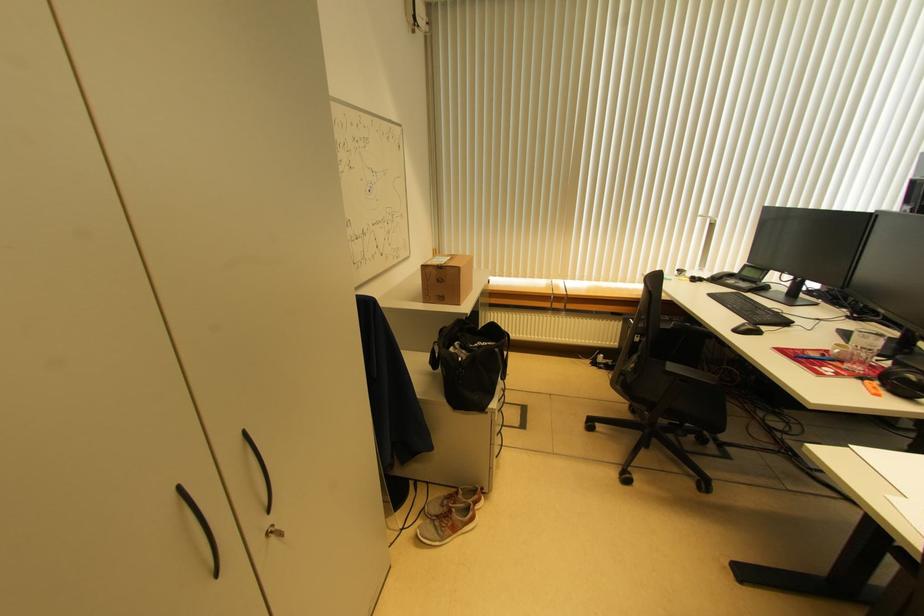
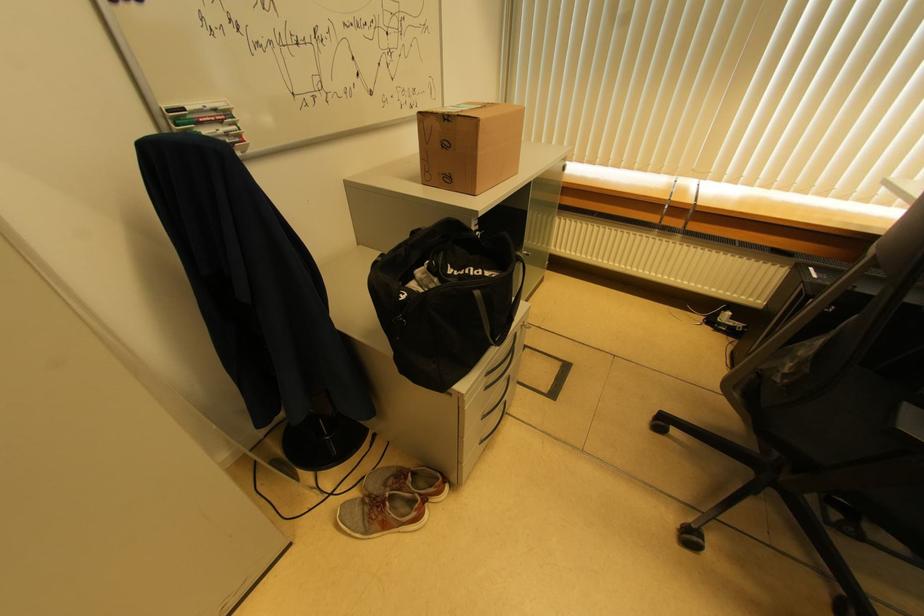
Where in the second image is the point corresponding to point (499, 353) from the first image?

(479, 296)